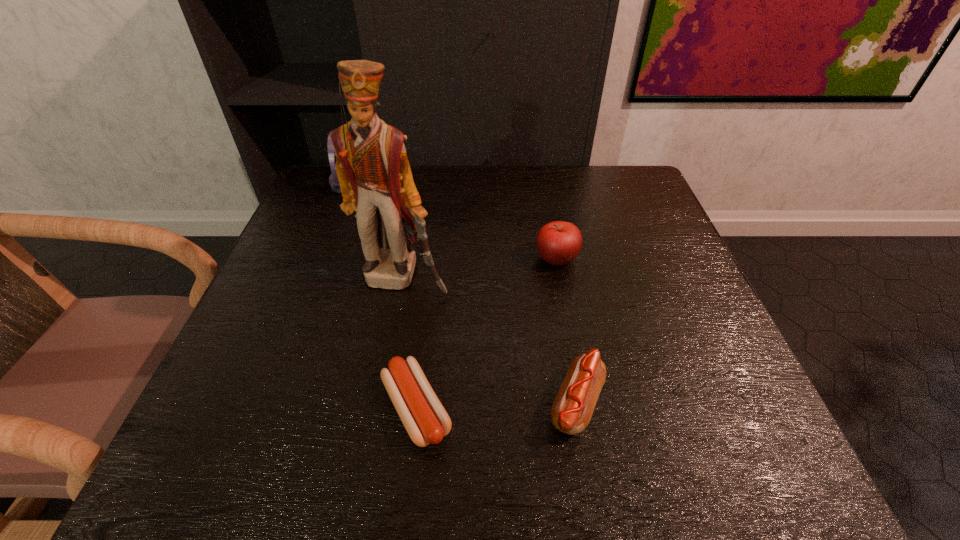
Where is `vacant space situated on the front of the third shortest object`? The height and width of the screenshot is (540, 960). vacant space situated on the front of the third shortest object is located at coordinates (569, 326).

Locate an element on the screen. The width and height of the screenshot is (960, 540). free space located on the right of the right sausage is located at coordinates (753, 404).

Locate an element on the screen. vacant space situated on the back of the shorter sausage is located at coordinates (433, 263).

Where is `object present at the far edge`? The image size is (960, 540). object present at the far edge is located at coordinates (333, 179).

Where is `object located at the left edge`? Image resolution: width=960 pixels, height=540 pixels. object located at the left edge is located at coordinates (333, 179).

Image resolution: width=960 pixels, height=540 pixels. I want to click on object present at the far left corner, so click(333, 179).

In the image, there is a desktop. Identify the location of blank space at the far edge. (517, 189).

Identify the location of free space at the left edge. (343, 216).

In the image, there is a desktop. Where is `vacant space at the right edge`? Image resolution: width=960 pixels, height=540 pixels. vacant space at the right edge is located at coordinates (708, 380).

Image resolution: width=960 pixels, height=540 pixels. Identify the location of vacant space at the far left corner. [x=320, y=202].